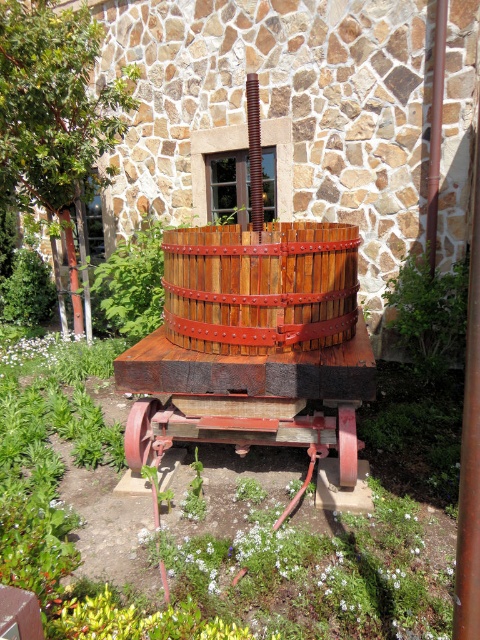
You are a gardener who needs to move the wooden barrel at center and the rustic wood wheel at center to a storage shed located 2 meters away. If you can carry both objects together, how far apart should you place them while carrying?

The wooden barrel at center and rustic wood wheel at center are 1.03 meters apart, so you should keep them at least 1.03 meters apart while carrying to maintain their original spacing.

You are a gardener who needs to move the wooden barrel at center and the rustic wood wheel at center to a storage shed. If the shed door is 1 meter wide, will both items fit through the door when moved individually?

The wooden barrel at center is wider than the rustic wood wheel at center. Since the shed door is 1 meter wide, we need to check if both items are narrower than 1 meter. However, the description only states their relative sizes, not their exact widths. Without knowing the actual dimensions, we cannot confirm if they will fit through the 1 meter wide shed door.